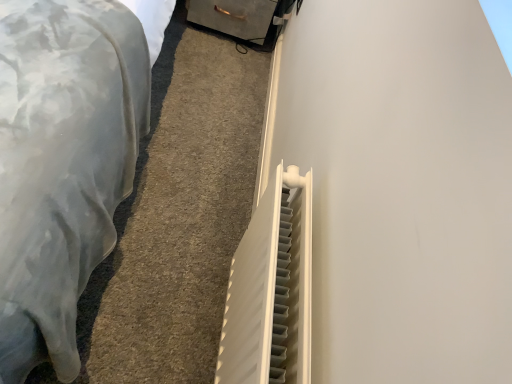
Question: Is point (249, 24) closer or farther from the camera than point (6, 172)?

Choices:
 (A) closer
 (B) farther

Answer: (B)

Question: Visually, is metallic gray drawer at upper center positioned to the left or to the right of white plastic radiator at lower right?

Choices:
 (A) right
 (B) left

Answer: (A)

Question: Which object is positioned farthest from the white plastic radiator at center-right?

Choices:
 (A) metallic gray drawer at upper center
 (B) white plastic radiator at lower right

Answer: (A)

Question: Estimate the real-world distances between objects in this image. Which object is farther from the metallic gray drawer at upper center?

Choices:
 (A) white plastic radiator at lower right
 (B) white plastic radiator at center-right

Answer: (B)